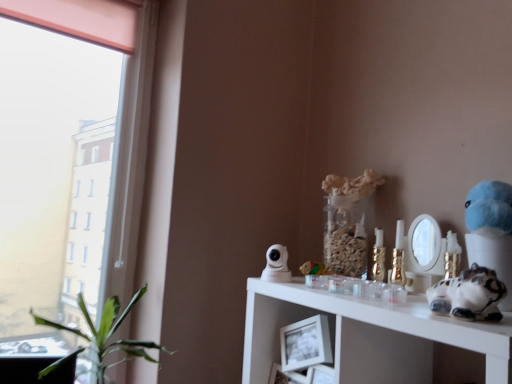
Question: Should I look upward or downward to see green leafy plant at left?

Choices:
 (A) up
 (B) down

Answer: (B)

Question: Is white glossy cat figurine at right, placed as the 1th toy when sorted from right to left, outside gold metallic candle holder at upper right?

Choices:
 (A) yes
 (B) no

Answer: (A)

Question: From a real-world perspective, is white glossy cat figurine at right, marked as the 1th toy in a front-to-back arrangement, over gold metallic candle holder at upper right?

Choices:
 (A) yes
 (B) no

Answer: (B)

Question: From the image's perspective, does white glossy cat figurine at right, the 2th toy when ordered from back to front, appear lower than gold metallic candle holder at upper right?

Choices:
 (A) no
 (B) yes

Answer: (A)

Question: Can you confirm if white glossy cat figurine at right, placed as the 1th toy when sorted from right to left, is taller than gold metallic candle holder at upper right?

Choices:
 (A) no
 (B) yes

Answer: (A)

Question: Does white glossy cat figurine at right, placed as the 1th toy when sorted from right to left, turn towards gold metallic candle holder at upper right?

Choices:
 (A) yes
 (B) no

Answer: (B)

Question: Can you confirm if white glossy cat figurine at right, marked as the 1th toy in a front-to-back arrangement, is wider than gold metallic candle holder at upper right?

Choices:
 (A) no
 (B) yes

Answer: (B)

Question: Is white glossy cat figurine at right, marked as the 1th toy in a front-to-back arrangement, at the right side of green leafy plant at left?

Choices:
 (A) yes
 (B) no

Answer: (A)

Question: Would you say white glossy cat figurine at right, marked as the 1th toy in a front-to-back arrangement, contains green leafy plant at left?

Choices:
 (A) yes
 (B) no

Answer: (B)

Question: Considering the relative sizes of white glossy cat figurine at right, the 2th toy when ordered from back to front, and green leafy plant at left in the image provided, is white glossy cat figurine at right, the 2th toy when ordered from back to front, smaller than green leafy plant at left?

Choices:
 (A) no
 (B) yes

Answer: (B)

Question: Is white glossy cat figurine at right, the 2th toy when ordered from left to right, not close to green leafy plant at left?

Choices:
 (A) no
 (B) yes

Answer: (A)

Question: Considering the relative sizes of white glossy cat figurine at right, placed as the 1th toy when sorted from right to left, and green leafy plant at left in the image provided, is white glossy cat figurine at right, placed as the 1th toy when sorted from right to left, thinner than green leafy plant at left?

Choices:
 (A) no
 (B) yes

Answer: (B)

Question: Is white glossy cat figurine at right, marked as the 1th toy in a front-to-back arrangement, beside green leafy plant at left?

Choices:
 (A) no
 (B) yes

Answer: (A)

Question: Does gold metallic candle holder at upper right lie in front of wooden block at center, the 1th toy viewed from the back?

Choices:
 (A) no
 (B) yes

Answer: (B)